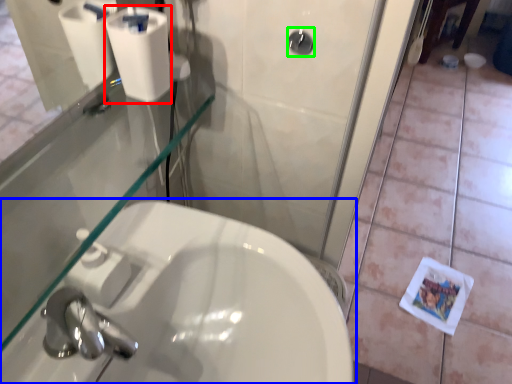
Question: Estimate the real-world distances between objects in this image. Which object is closer to toilet paper (highlighted by a red box), sink (highlighted by a blue box) or shower (highlighted by a green box)?

Choices:
 (A) sink
 (B) shower

Answer: (B)